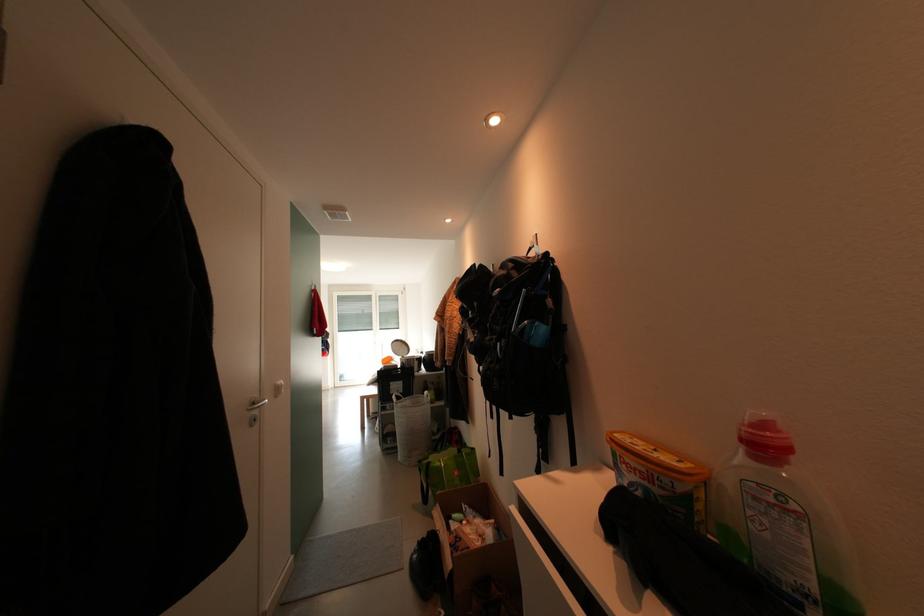
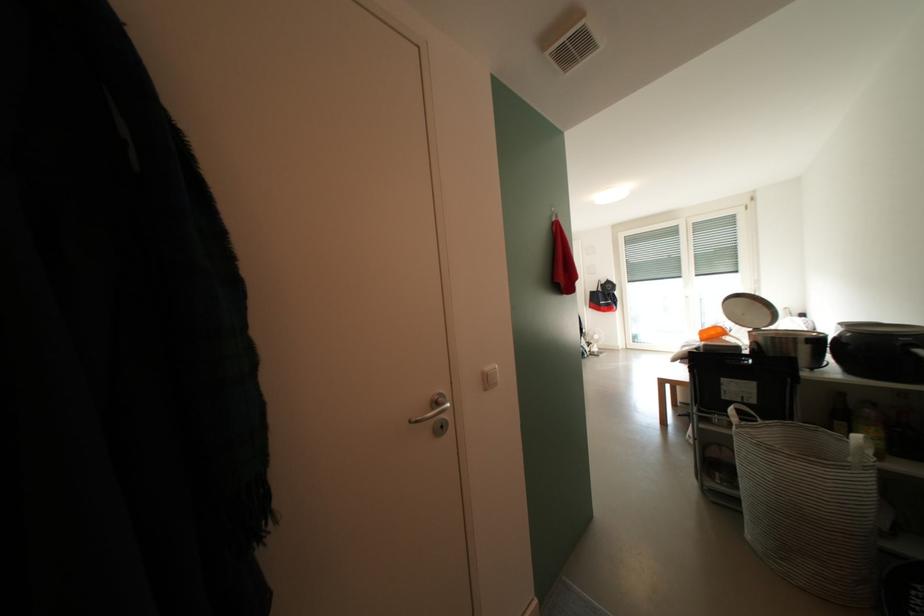
The point at (x=391, y=363) is marked in the first image. Where is the corresponding point in the second image?

(710, 336)